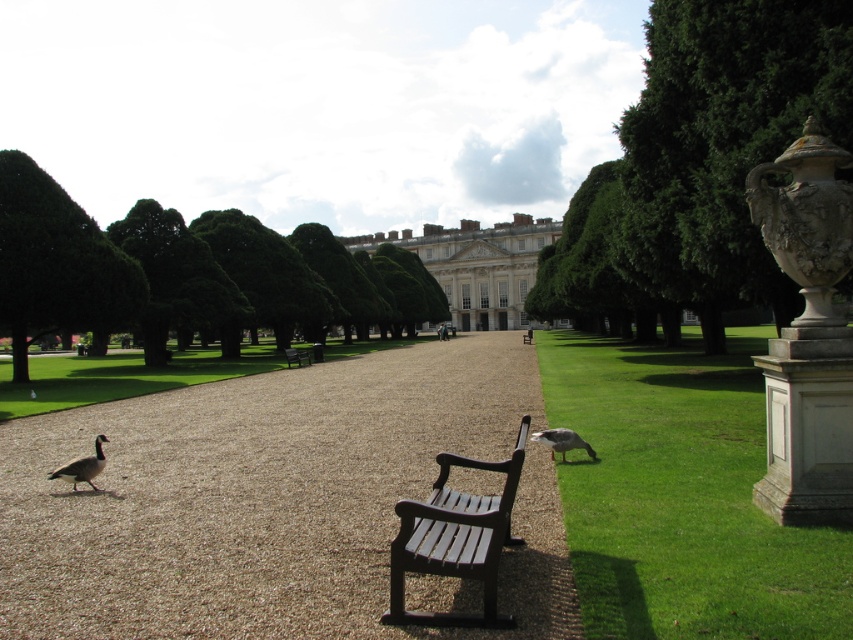
Question: Which object is the farthest from the white stone palace at center?

Choices:
 (A) green leafy tree at upper left
 (B) carved stone urn at right
 (C) green grass at lower right

Answer: (B)

Question: Which is nearer to the brown feathered goose at lower left?

Choices:
 (A) green grass at lower right
 (B) black wood bench at center

Answer: (B)

Question: Observing the image, what is the correct spatial positioning of green leafy tree at center in reference to green grass at center?

Choices:
 (A) left
 (B) right

Answer: (B)

Question: Is green leafy tree at center further to the viewer compared to green leafy tree at upper left?

Choices:
 (A) yes
 (B) no

Answer: (A)

Question: Does white stone palace at center appear on the right side of wooden bench at center?

Choices:
 (A) no
 (B) yes

Answer: (B)

Question: Which point appears closest to the camera in this image?

Choices:
 (A) (432, 266)
 (B) (51, 387)
 (C) (570, 372)

Answer: (C)